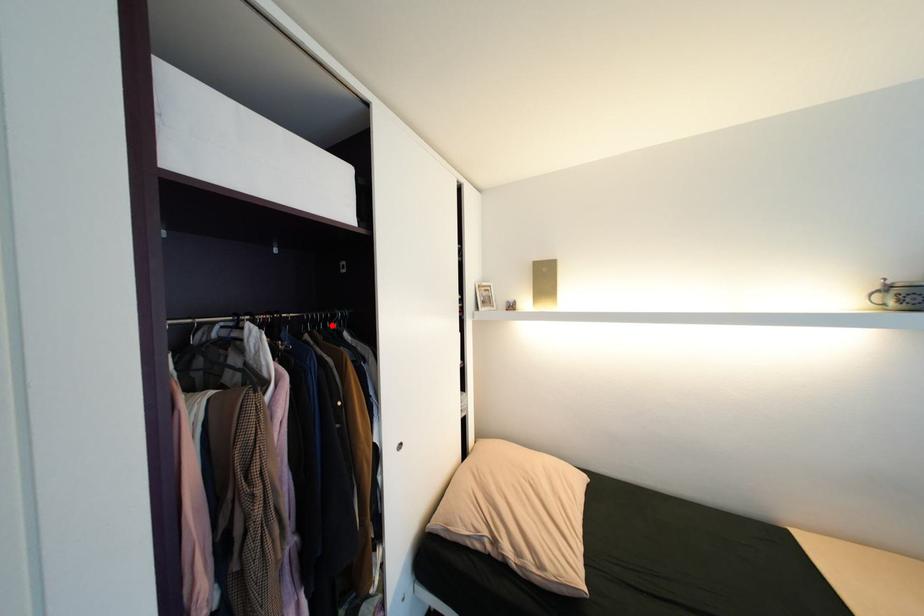
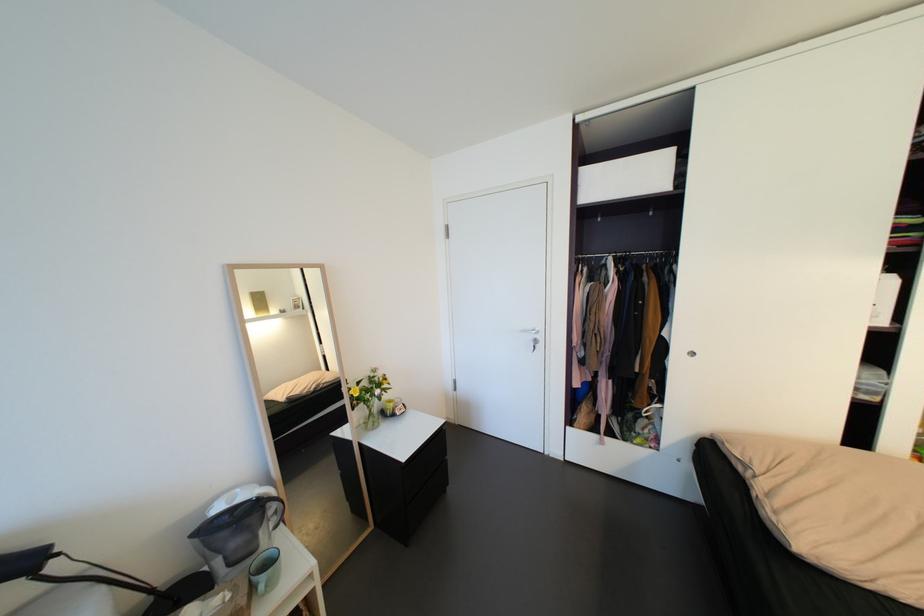
The point at the highlighted location is marked in the first image. Where is the corresponding point in the second image?

(667, 261)